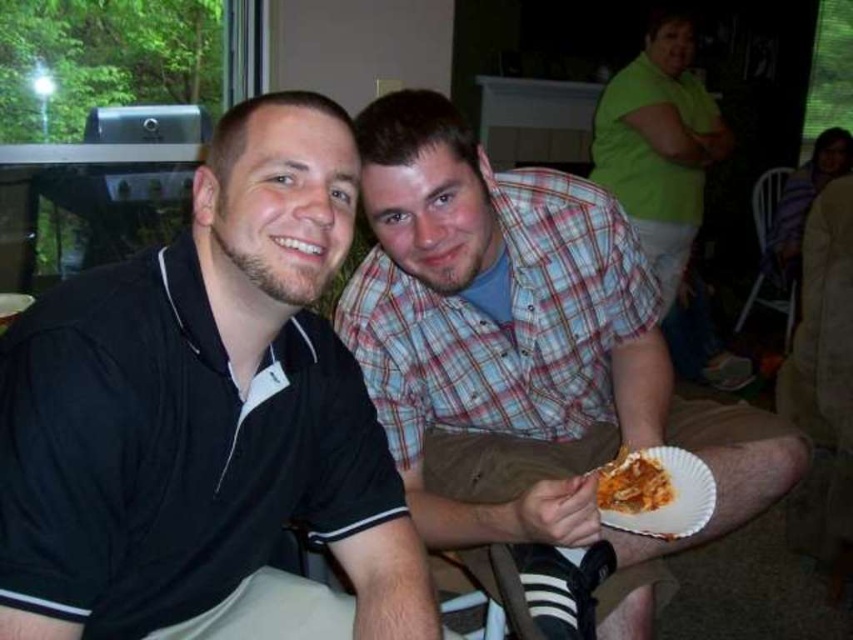
In the scene shown: Which of these two, black matte shirt at left or plaid shirt at center, stands taller?

plaid shirt at center is taller.

Which is above, black matte shirt at left or plaid shirt at center?

Positioned higher is plaid shirt at center.

Who is more forward, (209, 570) or (589, 307)?

Point (209, 570) is more forward.

Identify the location of black matte shirt at left. (207, 419).

Which is below, black matte shirt at left or shiny orange pasta at lower right?

shiny orange pasta at lower right

Who is positioned more to the right, black matte shirt at left or shiny orange pasta at lower right?

Positioned to the right is shiny orange pasta at lower right.

The height and width of the screenshot is (640, 853). What are the coordinates of `black matte shirt at left` in the screenshot? It's located at (207, 419).

At what (x,y) coordinates should I click in order to perform the action: click on black matte shirt at left. Please return your answer as a coordinate pair (x, y). The image size is (853, 640). Looking at the image, I should click on (207, 419).

Is black matte shirt at left thinner than white paper plate at lower right?

In fact, black matte shirt at left might be wider than white paper plate at lower right.

Is black matte shirt at left above white paper plate at lower right?

Yes, black matte shirt at left is above white paper plate at lower right.

Which is behind, point (306, 340) or point (691, 474)?

The point (691, 474) is behind.

This screenshot has width=853, height=640. What are the coordinates of `black matte shirt at left` in the screenshot? It's located at (207, 419).